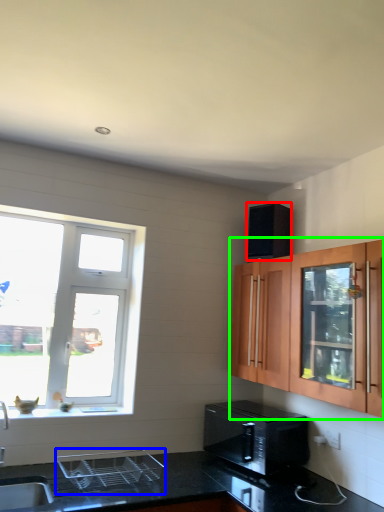
Question: Estimate the real-world distances between objects in this image. Which object is farther from appliance (highlighted by a red box), appliance (highlighted by a blue box) or cabinetry (highlighted by a green box)?

Choices:
 (A) appliance
 (B) cabinetry

Answer: (A)